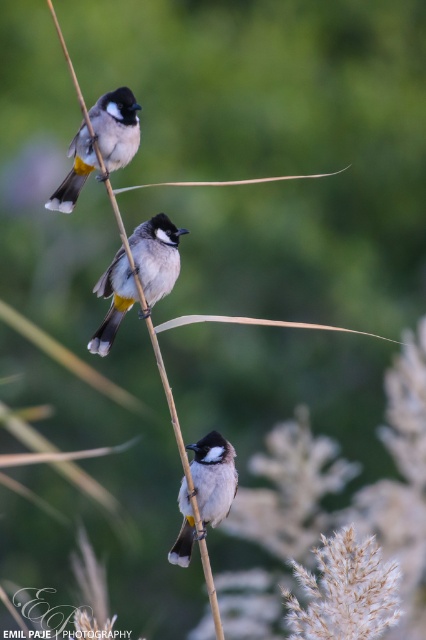
Can you confirm if white-feathered bird at upper center is positioned below white matte bird at center?

Incorrect, white-feathered bird at upper center is not positioned below white matte bird at center.

Is white-feathered bird at upper center wider than white matte bird at center?

Yes, white-feathered bird at upper center is wider than white matte bird at center.

What do you see at coordinates (115, 125) in the screenshot? This screenshot has width=426, height=640. I see `white-feathered bird at upper center` at bounding box center [115, 125].

The height and width of the screenshot is (640, 426). In order to click on white-feathered bird at upper center in this screenshot , I will do `click(115, 125)`.

Between gray matte bird at center and white-feathered bird at upper center, which one has less height?

white-feathered bird at upper center is shorter.

Which is more to the right, gray matte bird at center or white-feathered bird at upper center?

gray matte bird at center is more to the right.

Which is behind, point (143, 243) or point (74, 161)?

Positioned behind is point (74, 161).

The width and height of the screenshot is (426, 640). Identify the location of gray matte bird at center. (x=155, y=257).

Which is below, gray matte bird at center or white matte bird at center?

white matte bird at center is lower down.

Which is in front, point (132, 292) or point (193, 465)?

Point (193, 465)

Where is `gray matte bird at center`? This screenshot has width=426, height=640. gray matte bird at center is located at coordinates (x=155, y=257).